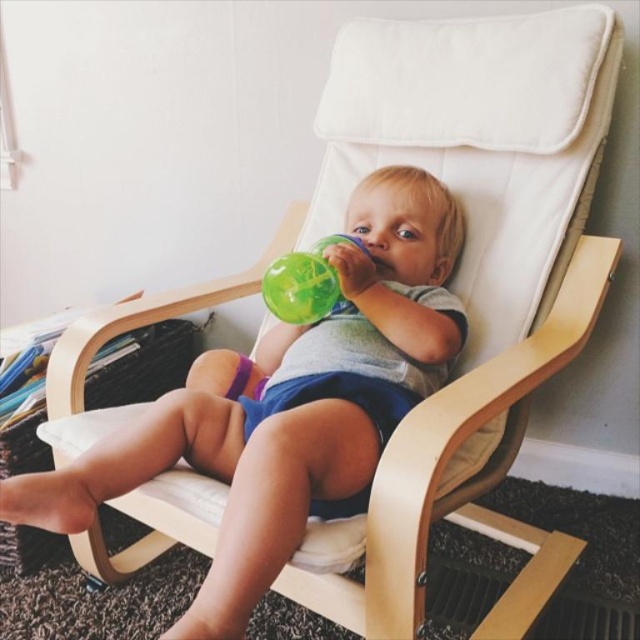
Does matte green sippy cup at center appear on the right side of translucent green cup at center?

No, matte green sippy cup at center is not to the right of translucent green cup at center.

Who is positioned more to the right, matte green sippy cup at center or translucent green cup at center?

translucent green cup at center is more to the right.

Does point (260, 394) come behind point (268, 307)?

Yes, it is behind point (268, 307).

Where is `matte green sippy cup at center`? The image size is (640, 640). matte green sippy cup at center is located at coordinates click(291, 404).